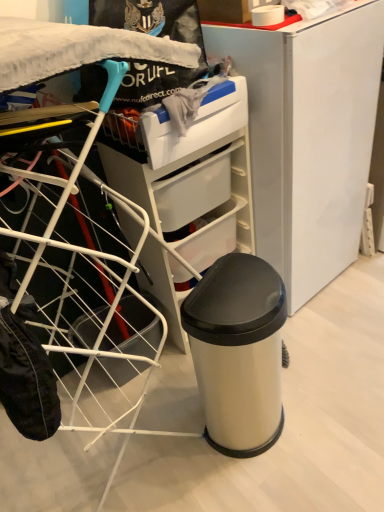
Question: Can you confirm if satin silver trash can at center is smaller than satin white fridge at center?

Choices:
 (A) yes
 (B) no

Answer: (A)

Question: Considering the relative positions of satin silver trash can at center and satin white fridge at center in the image provided, is satin silver trash can at center to the left of satin white fridge at center from the viewer's perspective?

Choices:
 (A) no
 (B) yes

Answer: (B)

Question: From the image's perspective, is satin silver trash can at center under satin white fridge at center?

Choices:
 (A) no
 (B) yes

Answer: (B)

Question: From a real-world perspective, is satin silver trash can at center on top of satin white fridge at center?

Choices:
 (A) no
 (B) yes

Answer: (A)

Question: Is there a large distance between satin silver trash can at center and satin white fridge at center?

Choices:
 (A) yes
 (B) no

Answer: (B)

Question: From the image's perspective, would you say satin silver trash can at center is positioned over satin white fridge at center?

Choices:
 (A) yes
 (B) no

Answer: (B)

Question: Would you say satin white fridge at center contains satin silver trash can at center?

Choices:
 (A) no
 (B) yes

Answer: (A)

Question: Considering the relative sizes of satin white fridge at center and satin silver trash can at center in the image provided, is satin white fridge at center bigger than satin silver trash can at center?

Choices:
 (A) no
 (B) yes

Answer: (B)

Question: Can you confirm if satin white fridge at center is positioned to the left of satin silver trash can at center?

Choices:
 (A) no
 (B) yes

Answer: (A)

Question: Does satin white fridge at center lie in front of satin silver trash can at center?

Choices:
 (A) yes
 (B) no

Answer: (B)

Question: From a real-world perspective, is satin white fridge at center located higher than satin silver trash can at center?

Choices:
 (A) yes
 (B) no

Answer: (A)

Question: Can you confirm if satin white fridge at center is shorter than satin silver trash can at center?

Choices:
 (A) no
 (B) yes

Answer: (A)

Question: Is satin white laundry basket at left thinner than satin white fridge at center?

Choices:
 (A) yes
 (B) no

Answer: (B)